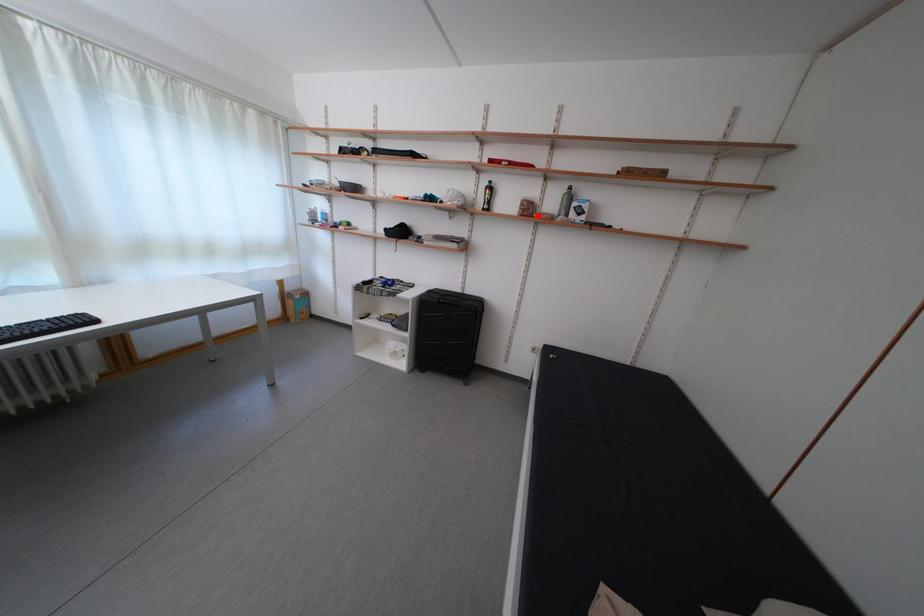
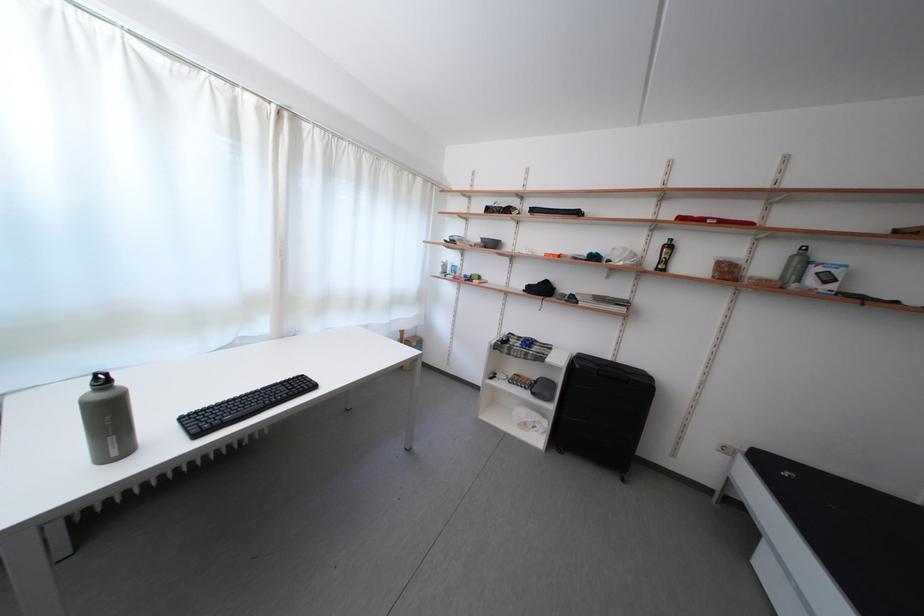
Where in the second image is the point corresponding to the highlighted location from the first image?

(736, 278)